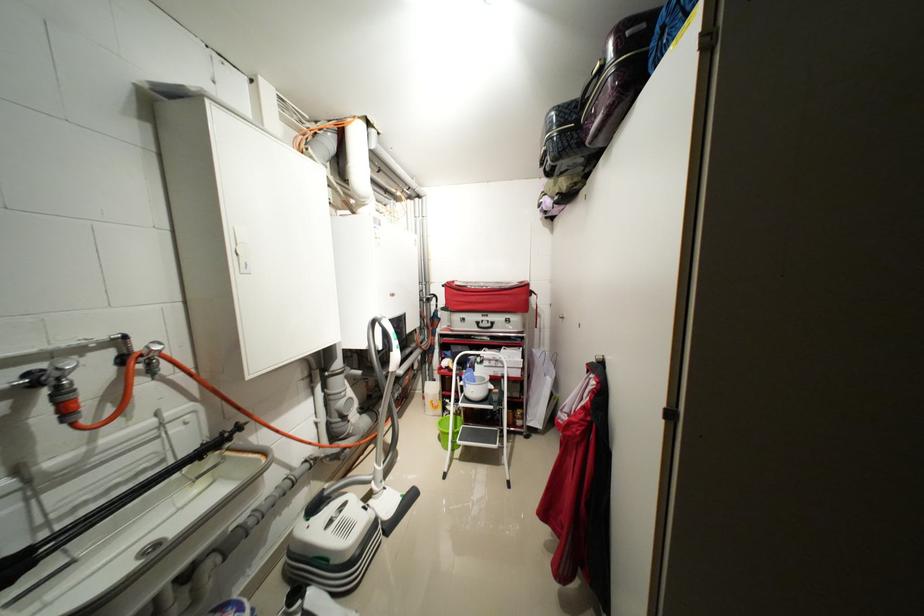
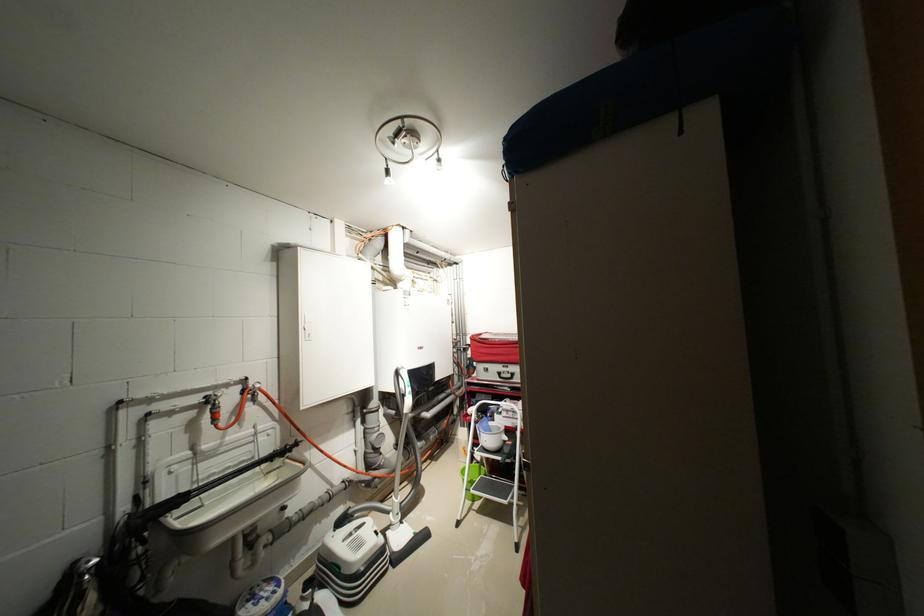
Find the pixel in the second image that matches pixel 188 429 in the first image.

(273, 439)